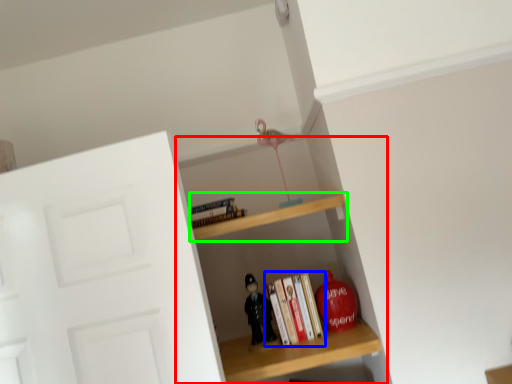
Question: Which object is the closest to the shelf (highlighted by a red box)? Choose among these: book (highlighted by a blue box) or shelf (highlighted by a green box).

Choices:
 (A) book
 (B) shelf

Answer: (A)